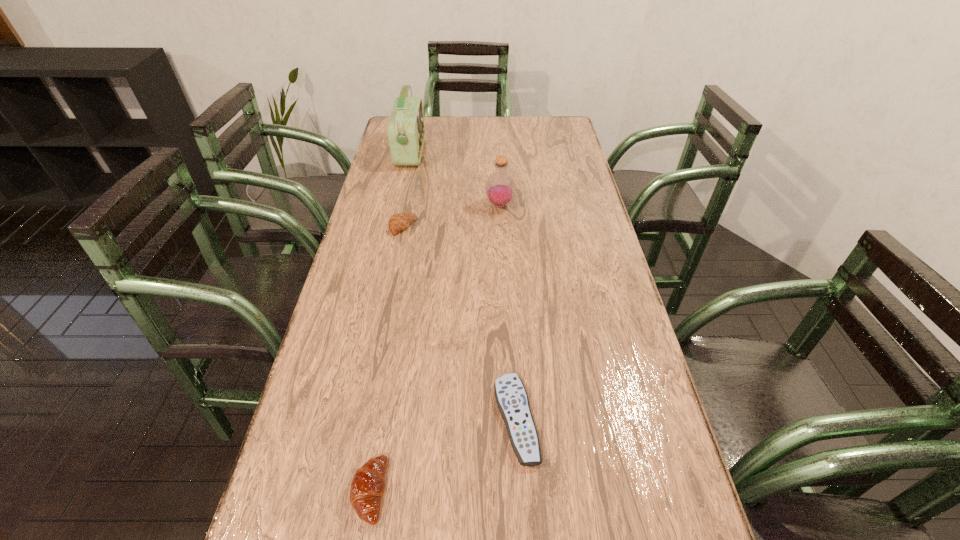
The image size is (960, 540). I want to click on radio receiver, so click(405, 129).

The width and height of the screenshot is (960, 540). What are the coordinates of `the farthest object` in the screenshot? It's located at (405, 129).

The image size is (960, 540). Identify the location of the fourth shortest object. (500, 187).

Locate an element on the screen. The width and height of the screenshot is (960, 540). the fourth nearest object is located at coordinates (500, 187).

Image resolution: width=960 pixels, height=540 pixels. I want to click on the third nearest object, so click(400, 221).

Locate an element on the screen. the nearer crescent roll is located at coordinates (368, 484).

Image resolution: width=960 pixels, height=540 pixels. I want to click on remote control, so click(512, 400).

You are a GUI agent. You are given a task and a screenshot of the screen. Output one action in this format:
    pyautogui.click(x=<x>, y=<y>)
    Task: Click on the vacant area located on the front panel of the farthest object
    This screenshot has height=540, width=960.
    Given the screenshot: What is the action you would take?
    pyautogui.click(x=476, y=152)

Locate an element on the screen. This screenshot has width=960, height=540. free space located 0.310m on the front of the bottle is located at coordinates (504, 284).

Locate an element on the screen. This screenshot has height=540, width=960. free space located on the back of the farther crescent roll is located at coordinates (407, 206).